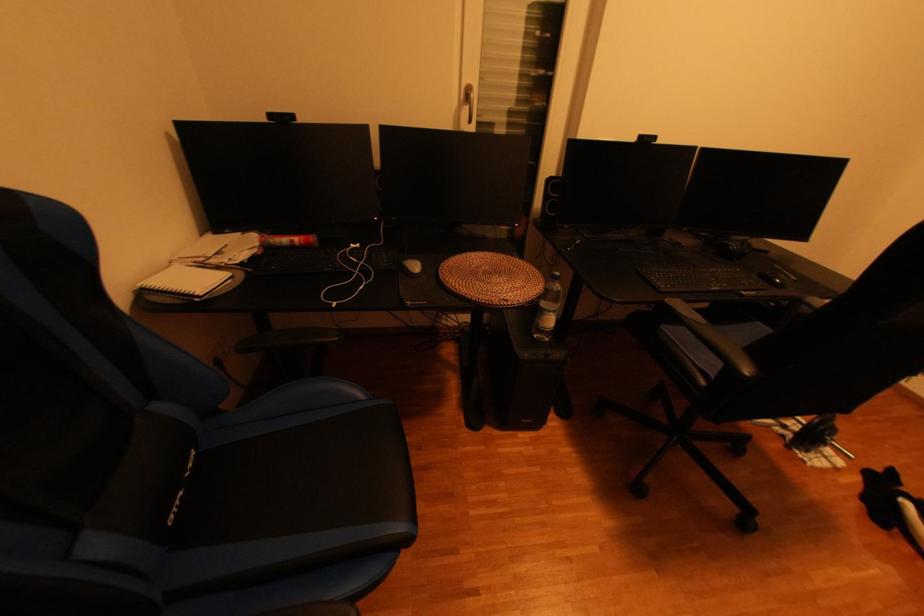
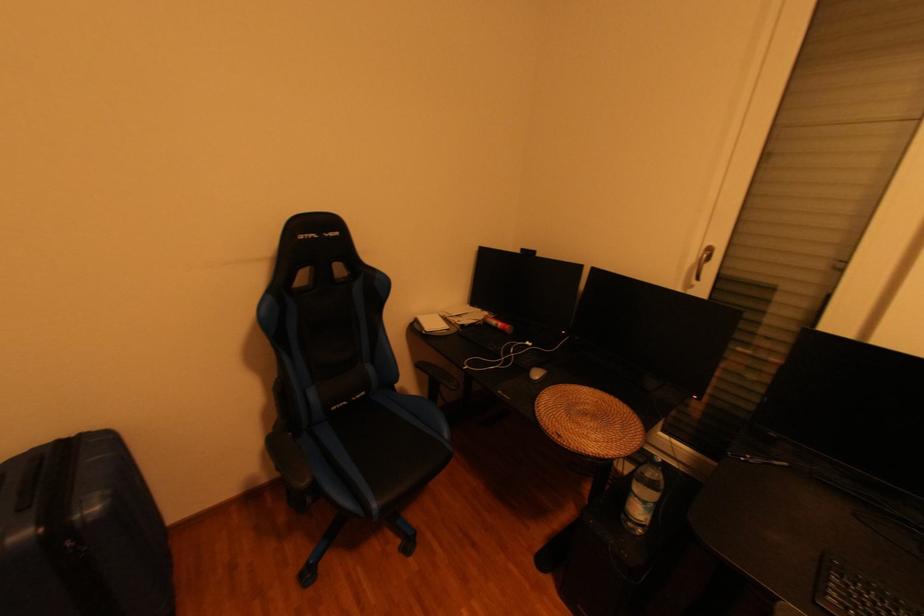
Question: The camera is either moving clockwise (left) or counter-clockwise (right) around the object. The first image is from the beginning of the video and the second image is from the end. Is the camera moving left or right when shooting the video?

Choices:
 (A) Left
 (B) Right

Answer: (B)